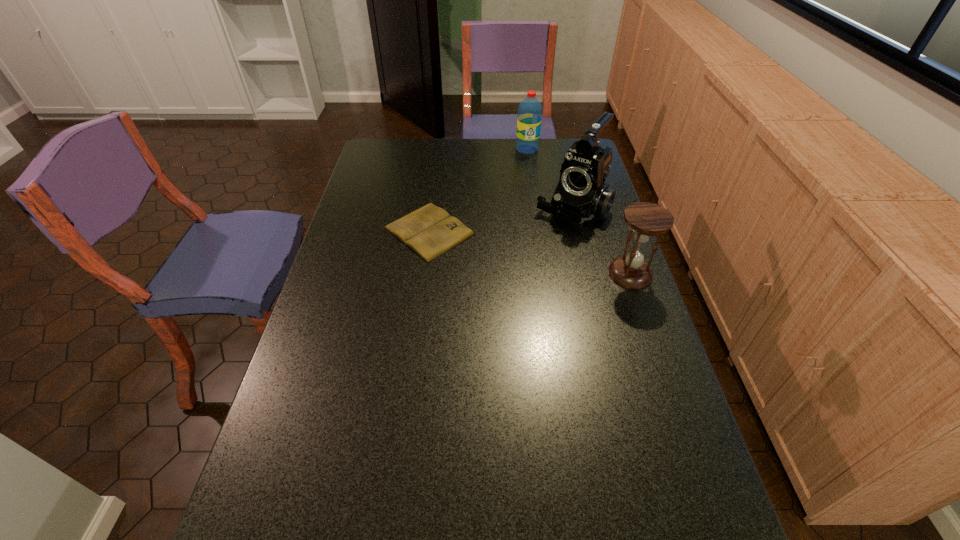
The width and height of the screenshot is (960, 540). Find the location of `vacant spot on the desktop that is between the shortest object and the hourglass and is positioned on the lens mount of the tallest object`. vacant spot on the desktop that is between the shortest object and the hourglass and is positioned on the lens mount of the tallest object is located at coordinates tap(535, 254).

Identify the location of vacant spot on the desktop that is between the shortest object and the hourglass and is positioned on the front label of the water bottle. The width and height of the screenshot is (960, 540). (518, 250).